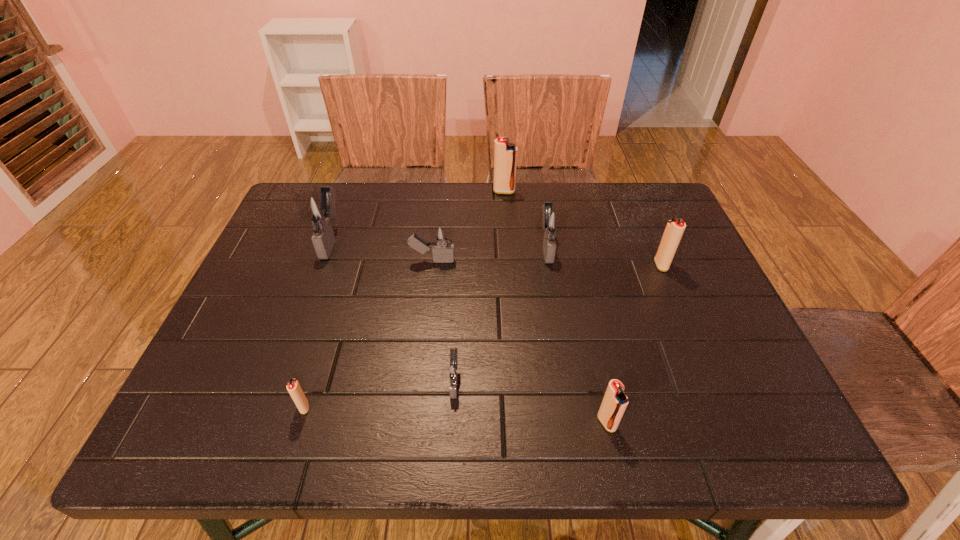
The width and height of the screenshot is (960, 540). What are the coordinates of `vacant space in between the second object from right to left and the third igniter from right to left` in the screenshot? It's located at (577, 334).

Where is `free area in between the farthest object and the nearest gray igniter`? The image size is (960, 540). free area in between the farthest object and the nearest gray igniter is located at coordinates (479, 286).

Where is `vacant space that is in between the second smallest gray igniter and the nearest gray igniter`? Image resolution: width=960 pixels, height=540 pixels. vacant space that is in between the second smallest gray igniter and the nearest gray igniter is located at coordinates (444, 320).

Find the location of a particular element. free spot between the seventh igniter from left to right and the second smallest gray igniter is located at coordinates (519, 341).

Find the location of `free space between the smallest gray igniter and the second smallest red igniter`. free space between the smallest gray igniter and the second smallest red igniter is located at coordinates (531, 401).

You are a GUI agent. You are given a task and a screenshot of the screen. Output one action in this format:
    pyautogui.click(x=<x>, y=<y>)
    Task: Click on the free spot between the leftmost igniter and the smallest gray igniter
    The width and height of the screenshot is (960, 540).
    Given the screenshot: What is the action you would take?
    pyautogui.click(x=394, y=310)

Locate an element on the screen. The image size is (960, 540). unoccupied position between the second igniter from left to right and the third smallest gray igniter is located at coordinates (425, 327).

Locate an element on the screen. The width and height of the screenshot is (960, 540). blank region between the seventh igniter from right to left and the second farthest red igniter is located at coordinates (483, 336).

This screenshot has width=960, height=540. I want to click on free space between the farthest object and the nearest gray igniter, so click(x=479, y=286).

At what (x,y) coordinates should I click in order to perform the action: click on free space that is in between the third biggest gray igniter and the smallest red igniter. Please return your answer as a coordinate pair (x, y). The image size is (960, 540). Looking at the image, I should click on (369, 334).